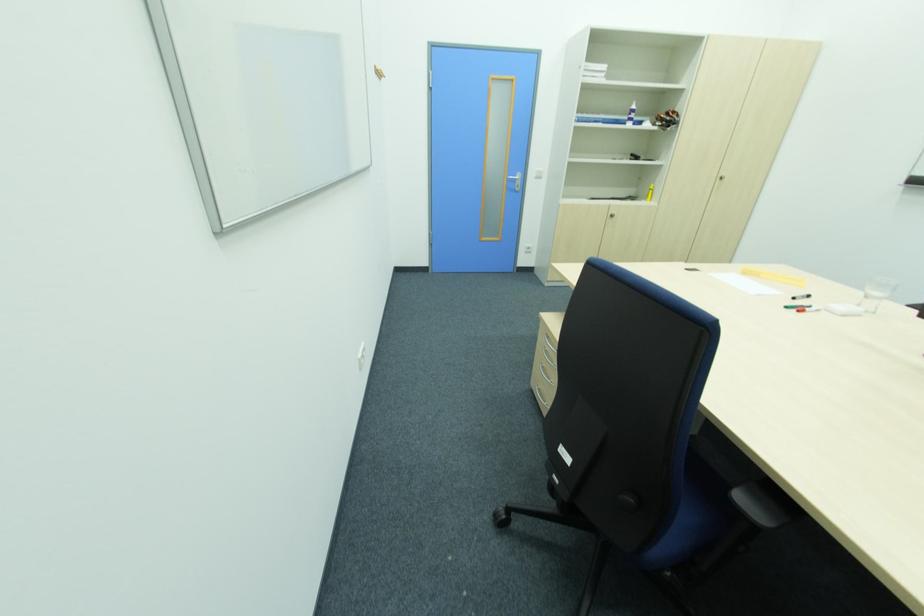
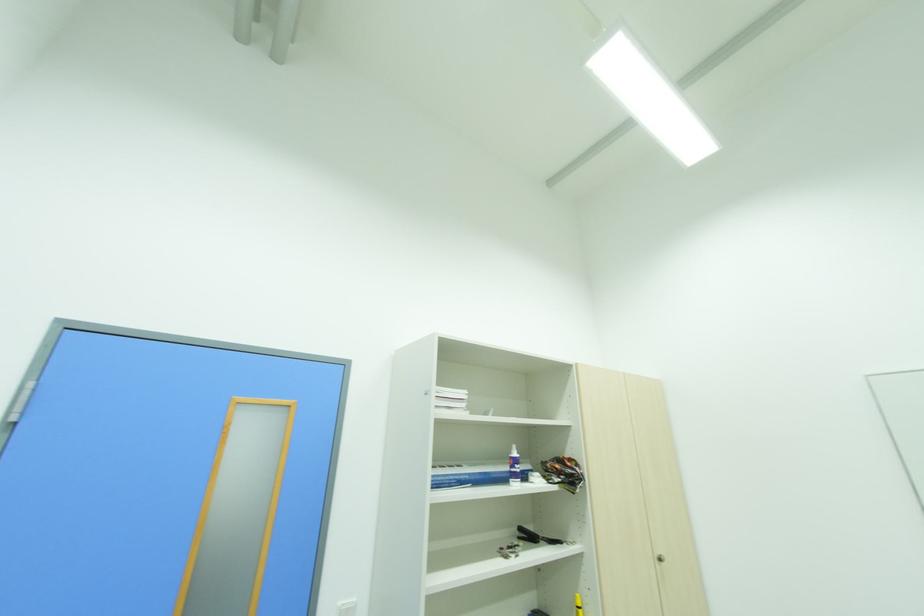
Locate, in the second image, the point that corresponds to point (540, 169) in the first image.

(344, 604)